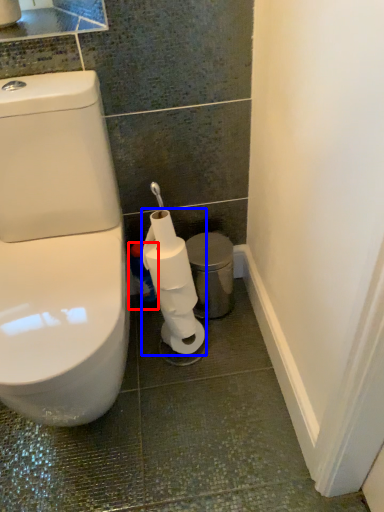
Question: Among these objects, which one is nearest to the camera, cleaning product (highlighted by a red box) or toilet paper (highlighted by a blue box)?

Choices:
 (A) cleaning product
 (B) toilet paper

Answer: (B)